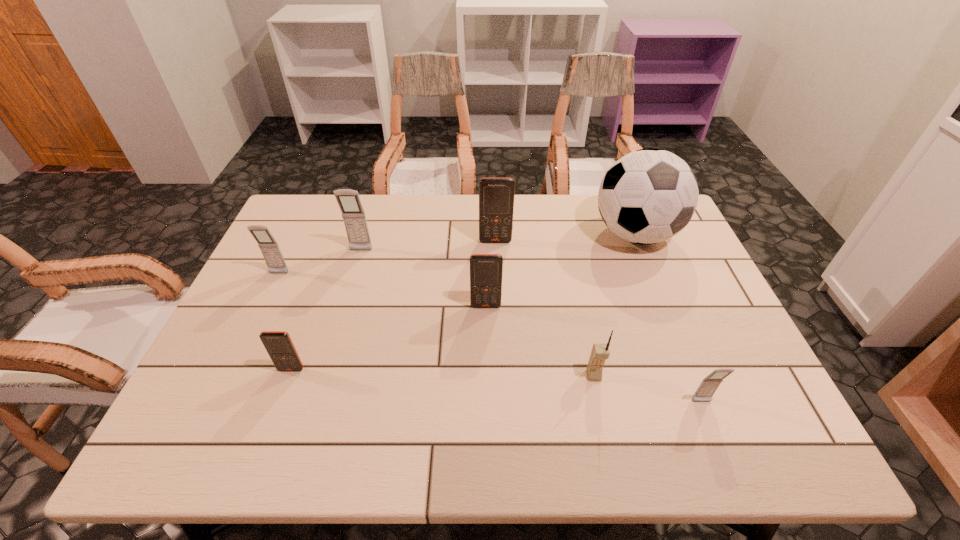
What are the coordinates of `free spot between the black soccer ball and the second smallest orange cellular telephone` in the screenshot? It's located at (561, 270).

Select which object appears as the second closest to the soccer ball. Please provide its 2D coordinates. Your answer should be formatted as a tuple, i.e. [(x, y)], where the tuple contains the x and y coordinates of a point satisfying the conditions above.

[(486, 270)]

Where is `the seventh closest object to the second farthest orange cellular telephone`? The image size is (960, 540). the seventh closest object to the second farthest orange cellular telephone is located at coordinates (271, 252).

Find the location of a particular element. The height and width of the screenshot is (540, 960). cellular telephone that stands as the fourth closest to the tallest object is located at coordinates (708, 386).

Locate an element on the screen. cellular telephone that is the third closest to the second farthest orange cellular telephone is located at coordinates (353, 214).

Where is `gray cellular telephone that is the closest to the nearest orange cellular telephone`? This screenshot has height=540, width=960. gray cellular telephone that is the closest to the nearest orange cellular telephone is located at coordinates (271, 252).

In order to click on the second closest gray cellular telephone to the fifth cellular telephone from right to left in this screenshot , I will do `click(708, 386)`.

Locate which orange cellular telephone is the second closest to the leftmost object. Please provide its 2D coordinates. Your answer should be formatted as a tuple, i.e. [(x, y)], where the tuple contains the x and y coordinates of a point satisfying the conditions above.

[(486, 270)]

Locate which orange cellular telephone is the third closest to the sixth object from left to right. Please provide its 2D coordinates. Your answer should be formatted as a tuple, i.e. [(x, y)], where the tuple contains the x and y coordinates of a point satisfying the conditions above.

[(278, 344)]